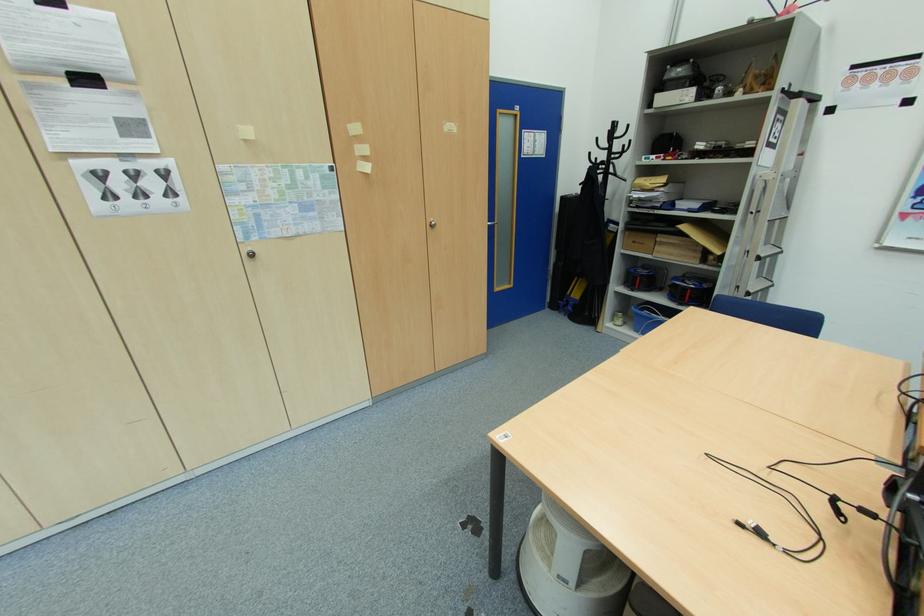
The location [649,315] corresponds to which object?

It corresponds to the blue plastic bin in the image.